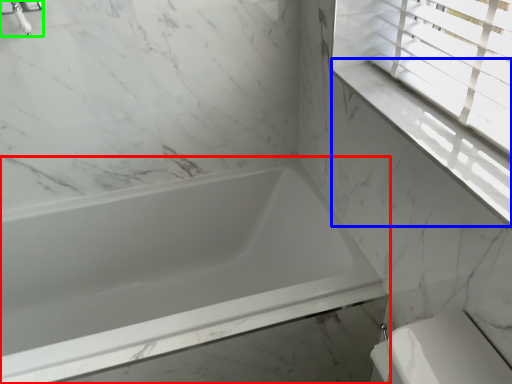
Question: Estimate the real-world distances between objects in this image. Which object is farther from bathtub (highlighted by a red box), window sill (highlighted by a blue box) or faucet (highlighted by a green box)?

Choices:
 (A) window sill
 (B) faucet

Answer: (B)